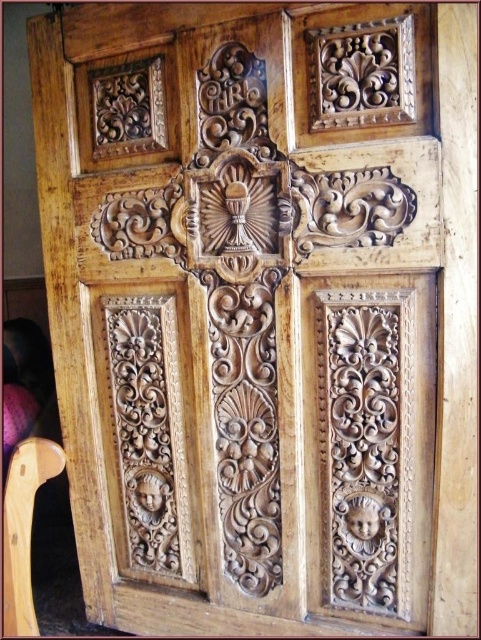
Question: Can you confirm if light brown wood carving at center-right is wider than light brown wood carving at lower left?

Choices:
 (A) no
 (B) yes

Answer: (A)

Question: Considering the real-world distances, which object is farthest from the light brown wood chair at lower left?

Choices:
 (A) light brown wood carving at center-right
 (B) light brown wood carving at lower left

Answer: (A)

Question: Which point is farther to the camera?

Choices:
 (A) light brown wood chair at lower left
 (B) light brown wood carving at lower left

Answer: (B)

Question: Which point is farther to the camera?

Choices:
 (A) (382, 464)
 (B) (179, 477)
 (C) (19, 588)

Answer: (B)

Question: Is light brown wood carving at lower left further to camera compared to light brown wood chair at lower left?

Choices:
 (A) no
 (B) yes

Answer: (B)

Question: Can you confirm if light brown wood carving at center-right is positioned to the right of light brown wood carving at lower left?

Choices:
 (A) no
 (B) yes

Answer: (B)